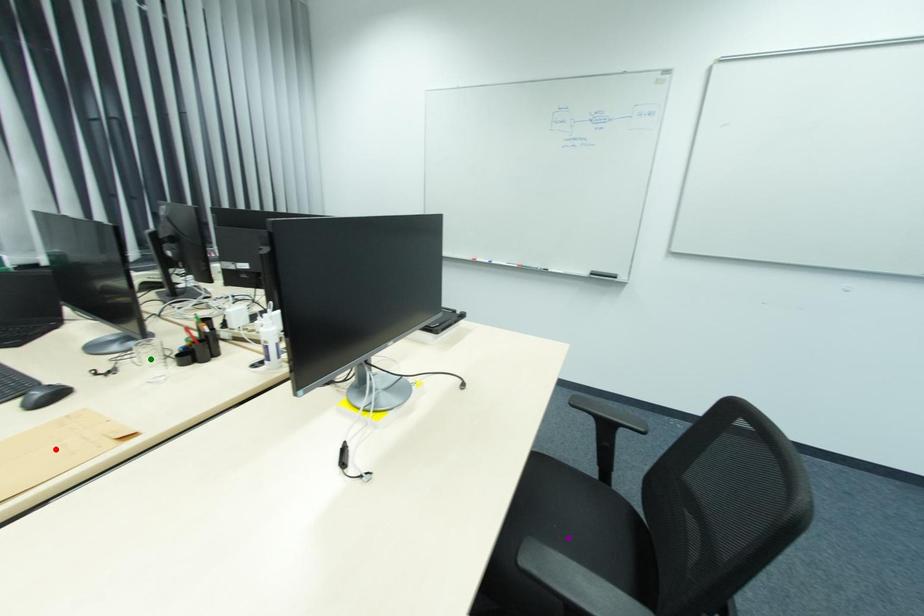
Order these from nearest to farthest:
A) red point
B) purple point
C) green point

purple point < green point < red point